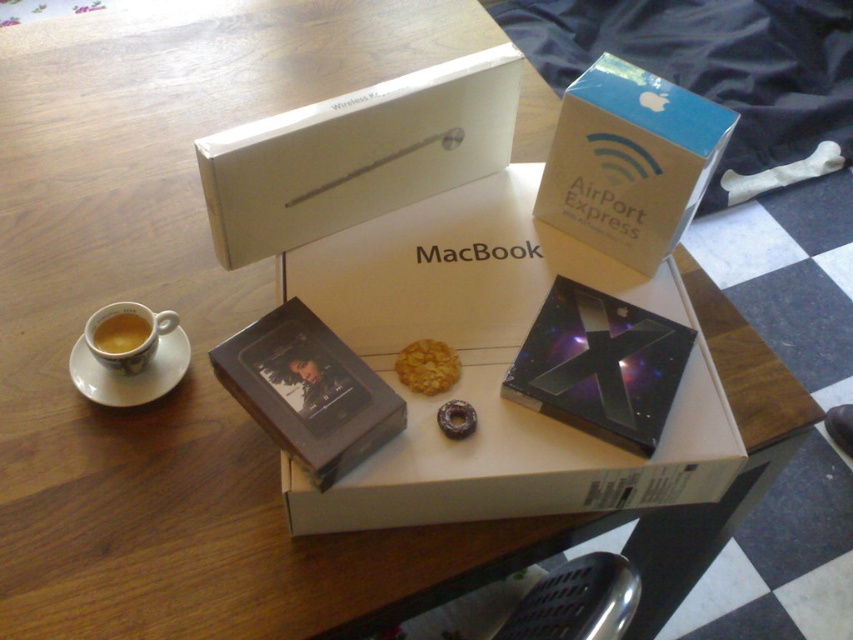
Does point (564, 99) lie in front of point (96, 339)?

Yes, point (564, 99) is in front of point (96, 339).

Between point (676, 140) and point (106, 348), which one is positioned behind?

Positioned behind is point (106, 348).

Locate an element on the screen. Image resolution: width=853 pixels, height=640 pixels. blue cardboard box at upper right is located at coordinates click(630, 161).

Can you confirm if white cardboard box at center is positioned to the right of blue cardboard box at upper right?

In fact, white cardboard box at center is to the left of blue cardboard box at upper right.

Who is more distant from viewer, (x=445, y=234) or (x=585, y=188)?

Positioned behind is point (x=445, y=234).

Between point (366, 524) and point (567, 204), which one is positioned behind?

Positioned behind is point (567, 204).

The height and width of the screenshot is (640, 853). I want to click on white cardboard box at center, so click(491, 369).

Is white cardboard box at center wider than matte ceramic cup at left?

Indeed, white cardboard box at center has a greater width compared to matte ceramic cup at left.

Which is behind, point (355, 522) or point (128, 321)?

Point (128, 321)

Is point (614, 500) in front of point (131, 342)?

Yes, it is.

This screenshot has width=853, height=640. I want to click on white cardboard box at center, so click(491, 369).